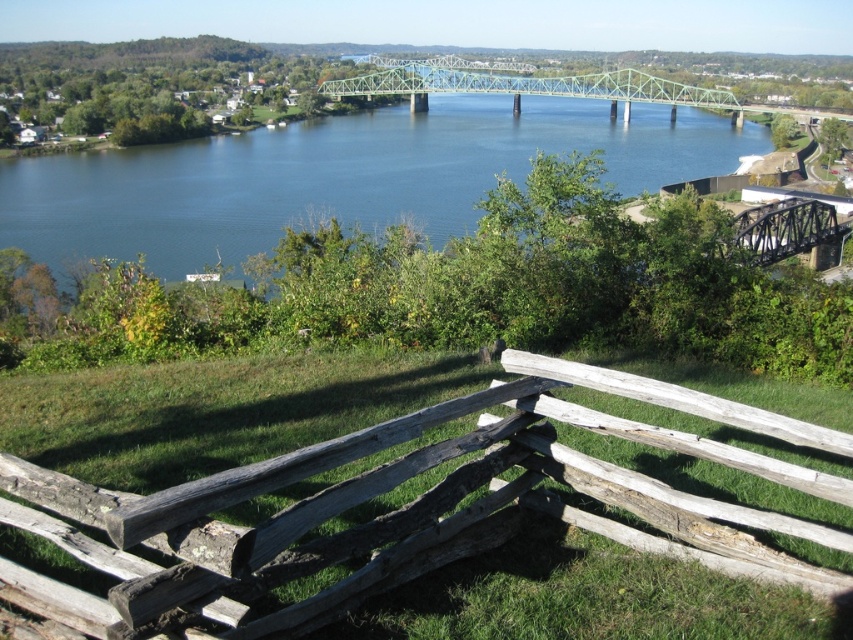
Question: Which object is the farthest from the weathered wood fence at lower center?

Choices:
 (A) blue water at center
 (B) green metallic bridge at center

Answer: (B)

Question: Which point appears farthest from the camera in this image?

Choices:
 (A) (576, 93)
 (B) (233, 404)
 (C) (19, 211)

Answer: (A)

Question: Can you confirm if weathered wood fence at lower center is bigger than blue water at center?

Choices:
 (A) no
 (B) yes

Answer: (A)

Question: Is weathered wood fence at lower center positioned before blue water at center?

Choices:
 (A) yes
 (B) no

Answer: (A)

Question: Does blue water at center lie in front of green metallic bridge at center?

Choices:
 (A) no
 (B) yes

Answer: (B)

Question: Considering the real-world distances, which object is closest to the weathered wood fence at lower center?

Choices:
 (A) green metallic bridge at center
 (B) blue water at center

Answer: (B)